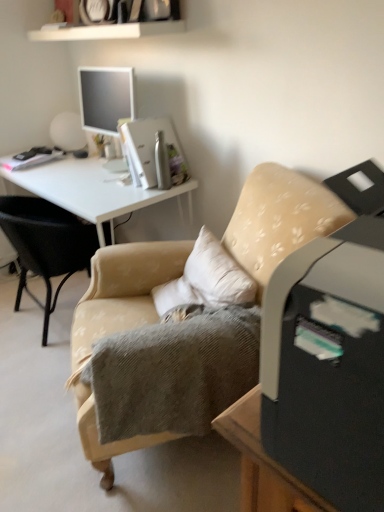
The image size is (384, 512). What do you see at coordinates (93, 190) in the screenshot? I see `white glossy desk at upper left` at bounding box center [93, 190].

How much space does beige fabric chair at center, marked as the second chair in a left-to-right arrangement, occupy vertically?

beige fabric chair at center, marked as the second chair in a left-to-right arrangement, is 95.10 centimeters tall.

What do you see at coordinates (118, 328) in the screenshot? I see `beige fabric chair at center, which ranks as the 1th chair in right-to-left order` at bounding box center [118, 328].

What do you see at coordinates (46, 244) in the screenshot?
I see `beige fabric chair at center, which appears as the 2th chair when viewed from the right` at bounding box center [46, 244].

This screenshot has width=384, height=512. In order to click on white glossy desk at upper left in this screenshot , I will do `click(93, 190)`.

From a real-world perspective, which is physically above, beige fabric chair at center, which ranks as the first chair in left-to-right order, or white glossy desk at upper left?

white glossy desk at upper left.

Is beige fabric chair at center, which appears as the 2th chair when viewed from the right, positioned beyond the bounds of white glossy desk at upper left?

No, beige fabric chair at center, which appears as the 2th chair when viewed from the right, is not entirely external to white glossy desk at upper left.

Is point (59, 275) in front of point (41, 175)?

Yes.

Considering the sizes of beige fabric chair at center, which ranks as the first chair in left-to-right order, and white glossy desk at upper left in the image, is beige fabric chair at center, which ranks as the first chair in left-to-right order, taller or shorter than white glossy desk at upper left?

In the image, beige fabric chair at center, which ranks as the first chair in left-to-right order, appears to be shorter than white glossy desk at upper left.

From the picture: Measure the distance from beige fabric chair at center, which ranks as the first chair in left-to-right order, to beige fabric chair at center, which ranks as the 1th chair in right-to-left order.

They are 25.07 inches apart.

From a real-world perspective, which object rests below the other?

From a 3D spatial view, beige fabric chair at center, which appears as the 2th chair when viewed from the right, is below.

Locate an element on the screen. chair below the beige fabric chair at center, marked as the second chair in a left-to-right arrangement (from a real-world perspective) is located at coordinates (46, 244).

Considering the sizes of objects beige fabric chair at center, which appears as the 2th chair when viewed from the right, and beige fabric chair at center, which ranks as the 1th chair in right-to-left order, in the image provided, who is wider, beige fabric chair at center, which appears as the 2th chair when viewed from the right, or beige fabric chair at center, which ranks as the 1th chair in right-to-left order,?

beige fabric chair at center, which ranks as the 1th chair in right-to-left order.

From a real-world perspective, which is physically above, beige fabric chair at center, marked as the second chair in a left-to-right arrangement, or beige fabric chair at center, which appears as the 2th chair when viewed from the right?

In real-world perspective, beige fabric chair at center, marked as the second chair in a left-to-right arrangement, is above.

Is beige fabric chair at center, marked as the second chair in a left-to-right arrangement, spatially inside beige fabric chair at center, which ranks as the first chair in left-to-right order, or outside of it?

The correct answer is: outside.

Considering the positions of objects beige fabric chair at center, marked as the second chair in a left-to-right arrangement, and beige fabric chair at center, which appears as the 2th chair when viewed from the right, in the image provided, who is behind, beige fabric chair at center, marked as the second chair in a left-to-right arrangement, or beige fabric chair at center, which appears as the 2th chair when viewed from the right,?

beige fabric chair at center, which appears as the 2th chair when viewed from the right, is more distant.

Based on the photo, how different are the orientations of beige fabric chair at center, marked as the second chair in a left-to-right arrangement, and beige fabric chair at center, which ranks as the first chair in left-to-right order, in degrees?

The angular difference between beige fabric chair at center, marked as the second chair in a left-to-right arrangement, and beige fabric chair at center, which ranks as the first chair in left-to-right order, is 153 degrees.

Is white glossy desk at upper left wider or thinner than beige fabric chair at center, marked as the second chair in a left-to-right arrangement?

Considering their sizes, white glossy desk at upper left looks slimmer than beige fabric chair at center, marked as the second chair in a left-to-right arrangement.

Is white glossy desk at upper left looking in the opposite direction of beige fabric chair at center, marked as the second chair in a left-to-right arrangement?

No, beige fabric chair at center, marked as the second chair in a left-to-right arrangement, is not at the back of white glossy desk at upper left.

Is white glossy desk at upper left positioned behind beige fabric chair at center, which ranks as the 1th chair in right-to-left order?

Yes.

Is white glossy desk at upper left taller or shorter than beige fabric chair at center, marked as the second chair in a left-to-right arrangement?

Clearly, white glossy desk at upper left is shorter compared to beige fabric chair at center, marked as the second chair in a left-to-right arrangement.

Between beige fabric chair at center, which ranks as the 1th chair in right-to-left order, and white glossy desk at upper left, which one appears on the left side from the viewer's perspective?

white glossy desk at upper left.

Consider the image. From the image's perspective, which is below, beige fabric chair at center, marked as the second chair in a left-to-right arrangement, or white glossy desk at upper left?

beige fabric chair at center, marked as the second chair in a left-to-right arrangement.

From a real-world perspective, who is located higher, beige fabric chair at center, which ranks as the 1th chair in right-to-left order, or white glossy desk at upper left?

From a 3D spatial view, beige fabric chair at center, which ranks as the 1th chair in right-to-left order, is above.

Consider the image. Who is bigger, beige fabric chair at center, which ranks as the 1th chair in right-to-left order, or white glossy desk at upper left?

beige fabric chair at center, which ranks as the 1th chair in right-to-left order.

Considering the relative sizes of white glossy desk at upper left and beige fabric chair at center, which appears as the 2th chair when viewed from the right, in the image provided, is white glossy desk at upper left wider than beige fabric chair at center, which appears as the 2th chair when viewed from the right,?

Correct, the width of white glossy desk at upper left exceeds that of beige fabric chair at center, which appears as the 2th chair when viewed from the right.

Is white glossy desk at upper left at the right side of beige fabric chair at center, which ranks as the first chair in left-to-right order?

Yes.

Does white glossy desk at upper left turn towards beige fabric chair at center, which ranks as the first chair in left-to-right order?

Yes, white glossy desk at upper left faces towards beige fabric chair at center, which ranks as the first chair in left-to-right order.

From the image's perspective, is white glossy desk at upper left above or below beige fabric chair at center, which ranks as the first chair in left-to-right order?

white glossy desk at upper left is situated higher than beige fabric chair at center, which ranks as the first chair in left-to-right order, in the image.

Find the location of a particular element. This screenshot has width=384, height=512. chair on the left of white glossy desk at upper left is located at coordinates (46, 244).

Where is `chair below the beige fabric chair at center, which ranks as the 1th chair in right-to-left order (from a real-world perspective)`? chair below the beige fabric chair at center, which ranks as the 1th chair in right-to-left order (from a real-world perspective) is located at coordinates point(46,244).

Looking at the image, which one is located closer to beige fabric chair at center, which ranks as the 1th chair in right-to-left order, white glossy desk at upper left or beige fabric chair at center, which ranks as the first chair in left-to-right order?

white glossy desk at upper left is closer to beige fabric chair at center, which ranks as the 1th chair in right-to-left order.

Which object lies nearer to the anchor point white glossy desk at upper left, beige fabric chair at center, marked as the second chair in a left-to-right arrangement, or beige fabric chair at center, which ranks as the first chair in left-to-right order?

beige fabric chair at center, which ranks as the first chair in left-to-right order, lies closer to white glossy desk at upper left than the other object.

Looking at the image, which one is located further to white glossy desk at upper left, beige fabric chair at center, which appears as the 2th chair when viewed from the right, or beige fabric chair at center, which ranks as the 1th chair in right-to-left order?

beige fabric chair at center, which ranks as the 1th chair in right-to-left order, is positioned further to the anchor white glossy desk at upper left.

Considering their positions, is white glossy desk at upper left positioned further to beige fabric chair at center, which appears as the 2th chair when viewed from the right, than beige fabric chair at center, which ranks as the 1th chair in right-to-left order?

Based on the image, beige fabric chair at center, which ranks as the 1th chair in right-to-left order, appears to be further to beige fabric chair at center, which appears as the 2th chair when viewed from the right.

Estimate the real-world distances between objects in this image. Which object is further from beige fabric chair at center, which ranks as the 1th chair in right-to-left order, beige fabric chair at center, which appears as the 2th chair when viewed from the right, or white glossy desk at upper left?

beige fabric chair at center, which appears as the 2th chair when viewed from the right, is positioned further to the anchor beige fabric chair at center, which ranks as the 1th chair in right-to-left order.

When comparing their distances from beige fabric chair at center, which appears as the 2th chair when viewed from the right, does beige fabric chair at center, which ranks as the 1th chair in right-to-left order, or white glossy desk at upper left seem further?

Based on the image, beige fabric chair at center, which ranks as the 1th chair in right-to-left order, appears to be further to beige fabric chair at center, which appears as the 2th chair when viewed from the right.

Locate an element on the screen. The image size is (384, 512). chair located between beige fabric chair at center, which ranks as the 1th chair in right-to-left order, and white glossy desk at upper left in the depth direction is located at coordinates (46, 244).